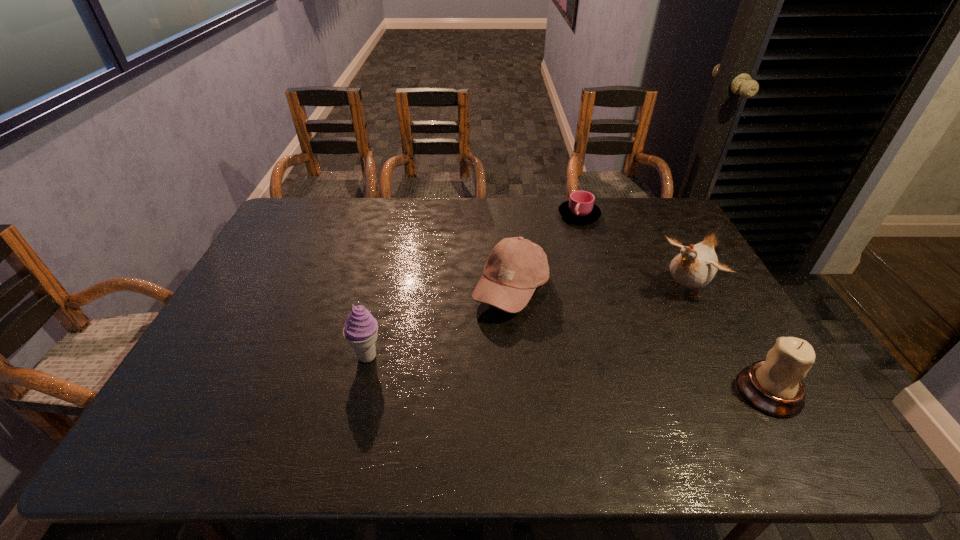
Image resolution: width=960 pixels, height=540 pixels. I want to click on free space on the desktop that is between the icecream and the candle holder and is positioned on the side with the handle of the cup, so click(x=585, y=375).

What are the coordinates of `free spot on the desktop that is between the icecream and the candle holder and is positioned at the beak of the bird` in the screenshot? It's located at point(575,375).

The height and width of the screenshot is (540, 960). In order to click on vacant space on the desktop that is between the leftmost object and the candle holder and is positioned on the front-facing side of the baseball cap in this screenshot , I will do `click(589, 376)`.